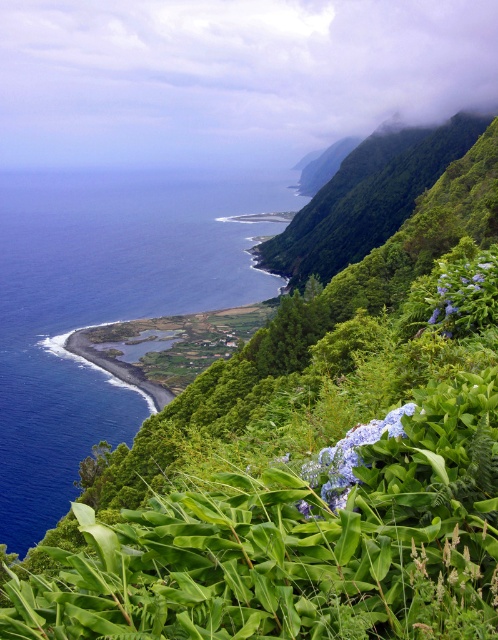
Is deep blue water at left positioned at the back of purple matte hydrangea at right?

That is True.

Can you confirm if deep blue water at left is wider than purple matte hydrangea at right?

Yes.

Is point (50, 256) in front of point (497, 312)?

That is False.

Where is `deep blue water at left`? Image resolution: width=498 pixels, height=640 pixels. deep blue water at left is located at coordinates (105, 305).

Can you confirm if deep blue water at left is shorter than blue matte hydrangea at center?

In fact, deep blue water at left may be taller than blue matte hydrangea at center.

Does deep blue water at left appear on the left side of blue matte hydrangea at center?

Indeed, deep blue water at left is positioned on the left side of blue matte hydrangea at center.

The image size is (498, 640). What are the coordinates of `deep blue water at left` in the screenshot? It's located at (105, 305).

Which of these two, purple matte hydrangea at right or blue matte hydrangea at center, stands shorter?

blue matte hydrangea at center

In the scene shown: Who is lower down, purple matte hydrangea at right or blue matte hydrangea at center?

Positioned lower is blue matte hydrangea at center.

Identify the location of purple matte hydrangea at right. (466, 292).